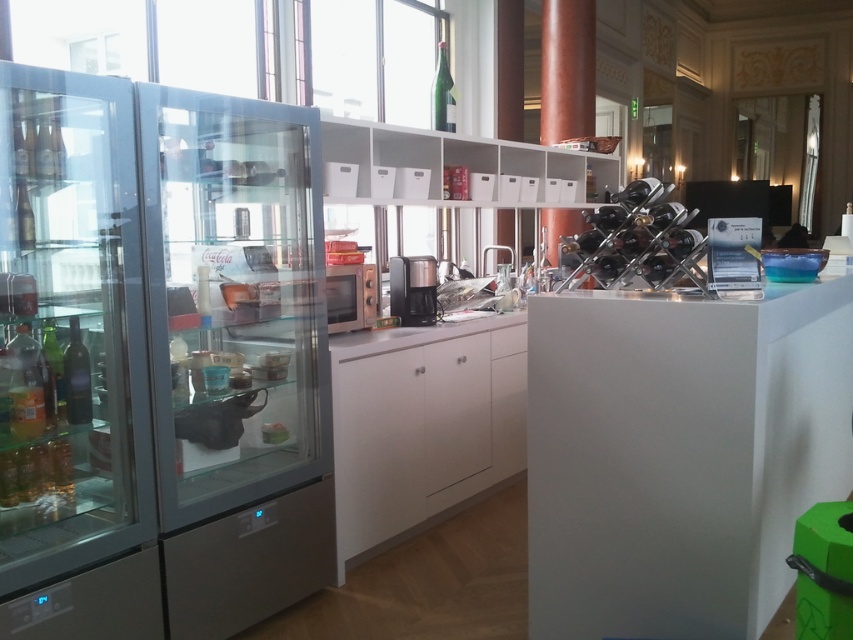
Question: Which point is farther from the camera taking this photo?

Choices:
 (A) (451, 120)
 (B) (428, 312)

Answer: (A)

Question: Can you confirm if white matte shelves at upper center is positioned to the right of black plastic coffee maker at center?

Choices:
 (A) yes
 (B) no

Answer: (A)

Question: Is matte black microwave at center above black plastic coffee maker at center?

Choices:
 (A) no
 (B) yes

Answer: (A)

Question: Which point appears farthest from the camera in this image?

Choices:
 (A) (293, 538)
 (B) (445, 84)
 (C) (339, 300)

Answer: (B)

Question: Which of the following is the farthest from the observer?

Choices:
 (A) (503, 156)
 (B) (370, 312)

Answer: (A)

Question: Is white matte shelves at upper center positioned behind green glass bottle at upper center?

Choices:
 (A) no
 (B) yes

Answer: (A)